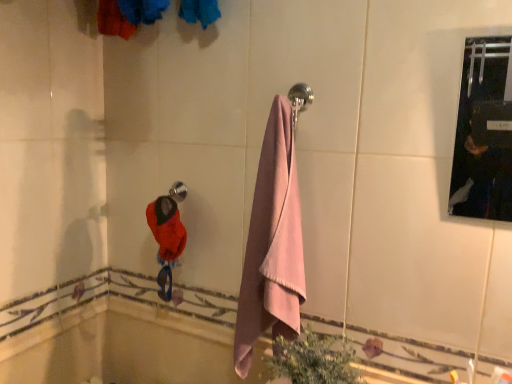
Question: Is soft blue fabric at upper center directly adjacent to polished chrome towel bar at upper center?

Choices:
 (A) yes
 (B) no

Answer: (B)

Question: Is the position of soft blue fabric at upper center less distant than that of polished chrome towel bar at upper center?

Choices:
 (A) yes
 (B) no

Answer: (A)

Question: Does soft blue fabric at upper center have a greater height compared to polished chrome towel bar at upper center?

Choices:
 (A) no
 (B) yes

Answer: (B)

Question: Considering the relative sizes of soft blue fabric at upper center and polished chrome towel bar at upper center in the image provided, is soft blue fabric at upper center thinner than polished chrome towel bar at upper center?

Choices:
 (A) no
 (B) yes

Answer: (A)

Question: Could you tell me if soft blue fabric at upper center is facing polished chrome towel bar at upper center?

Choices:
 (A) yes
 (B) no

Answer: (B)

Question: Considering the relative sizes of soft blue fabric at upper center and polished chrome towel bar at upper center in the image provided, is soft blue fabric at upper center shorter than polished chrome towel bar at upper center?

Choices:
 (A) no
 (B) yes

Answer: (A)

Question: Does pink cotton towel at center have a smaller size compared to soft blue fabric at upper center?

Choices:
 (A) no
 (B) yes

Answer: (A)

Question: Is soft blue fabric at upper center a part of pink cotton towel at center?

Choices:
 (A) no
 (B) yes

Answer: (A)

Question: Does pink cotton towel at center appear on the left side of soft blue fabric at upper center?

Choices:
 (A) yes
 (B) no

Answer: (B)

Question: Is pink cotton towel at center taller than soft blue fabric at upper center?

Choices:
 (A) no
 (B) yes

Answer: (B)

Question: Is pink cotton towel at center further to camera compared to soft blue fabric at upper center?

Choices:
 (A) no
 (B) yes

Answer: (B)

Question: From a real-world perspective, is pink cotton towel at center beneath soft blue fabric at upper center?

Choices:
 (A) no
 (B) yes

Answer: (B)

Question: Can you confirm if polished chrome towel bar at upper center is taller than pink cotton towel at center?

Choices:
 (A) yes
 (B) no

Answer: (B)